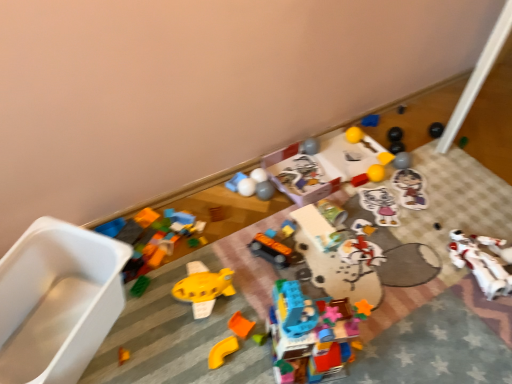
The image size is (512, 384). In order to click on free area in between orange matte plastic toy at lower center, the third toy when ordered from left to right, and translucent plastic building blocks at center, the 9th toy positioned from the left in this screenshot , I will do `click(247, 356)`.